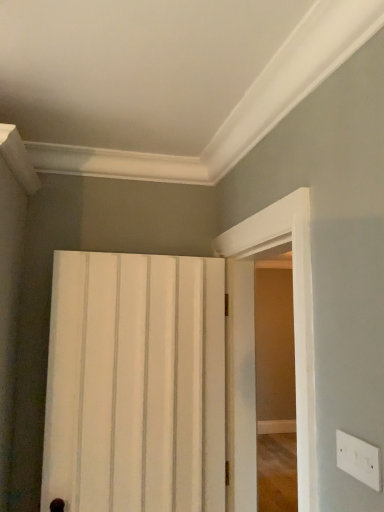
Question: In terms of size, does white matte door at center appear bigger or smaller than white plastic electric outlet at lower right?

Choices:
 (A) big
 (B) small

Answer: (A)

Question: From the image's perspective, is white matte door at center located above or below white plastic electric outlet at lower right?

Choices:
 (A) above
 (B) below

Answer: (B)

Question: Considering the real-world distances, which object is farthest from the white plastic electric outlet at lower right?

Choices:
 (A) white glossy door at right
 (B) white matte door at center

Answer: (B)

Question: Which object is positioned farthest from the white glossy door at right?

Choices:
 (A) white matte door at center
 (B) white plastic electric outlet at lower right

Answer: (B)